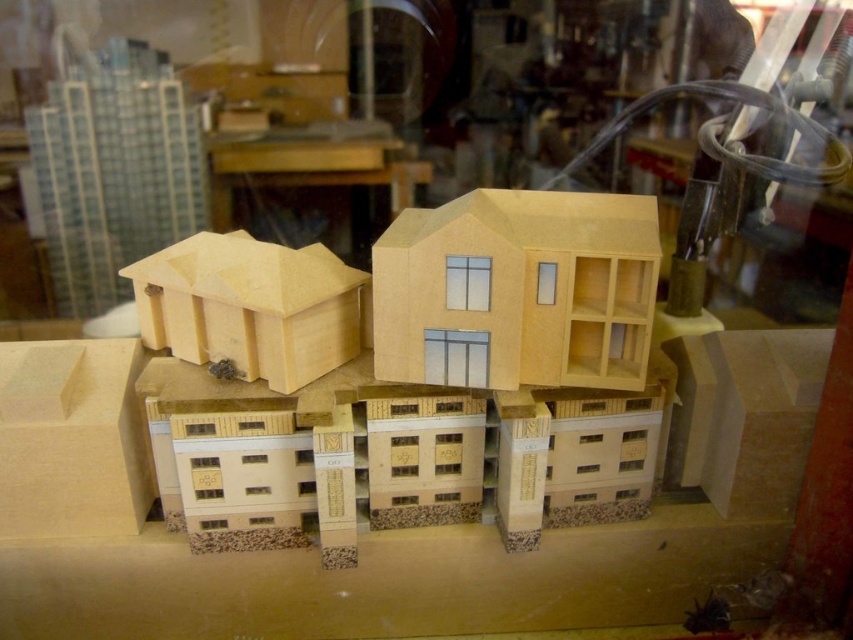
Question: Considering the relative positions of clear glass window at center and transparent glass shop window at center in the image provided, where is clear glass window at center located with respect to transparent glass shop window at center?

Choices:
 (A) below
 (B) above

Answer: (B)

Question: Can you confirm if clear glass window at center is bigger than transparent glass shop window at center?

Choices:
 (A) no
 (B) yes

Answer: (B)

Question: Does clear glass shop window at center have a lesser width compared to clear glass window at center?

Choices:
 (A) yes
 (B) no

Answer: (B)

Question: Among these points, which one is farthest from the camera?

Choices:
 (A) (459, 346)
 (B) (448, 289)
 (C) (540, 276)

Answer: (A)

Question: Which of the following is the closest to the observer?

Choices:
 (A) (550, 305)
 (B) (468, 307)
 (C) (428, 355)

Answer: (B)

Question: Which object appears closest to the camera in this image?

Choices:
 (A) clear glass shop window at center
 (B) transparent glass shop window at center
 (C) clear glass window at center

Answer: (C)